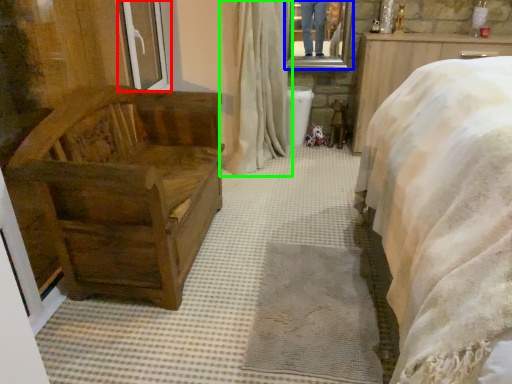
Question: Which object is the farthest from window frame (highlighted by a red box)? Choose among these: mirror (highlighted by a blue box) or curtain (highlighted by a green box).

Choices:
 (A) mirror
 (B) curtain

Answer: (A)